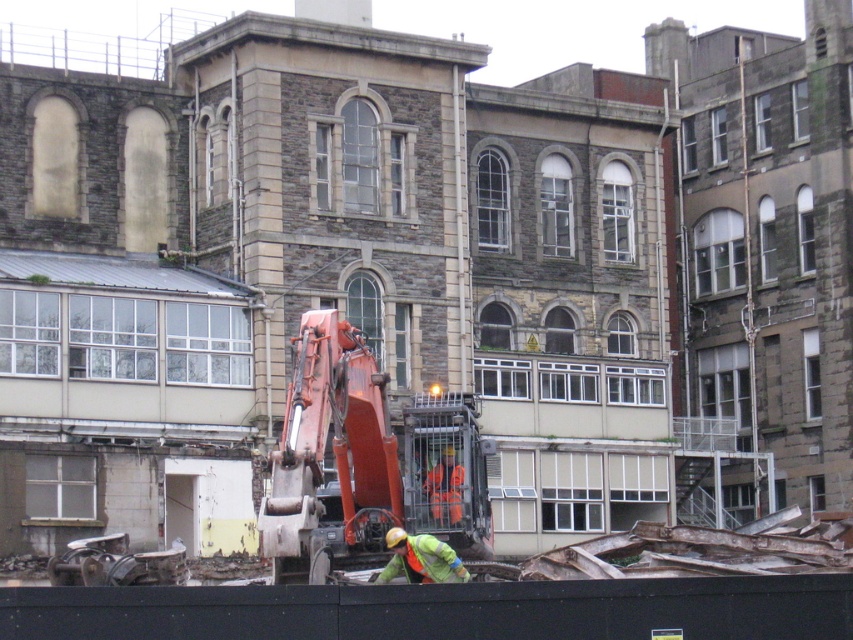
Can you confirm if orange metallic excavator at center is taller than green reflective jacket at center?

Indeed, orange metallic excavator at center has a greater height compared to green reflective jacket at center.

Is orange metallic excavator at center above green reflective jacket at center?

Yes.

Find the location of a particular element. The image size is (853, 640). orange metallic excavator at center is located at coordinates (367, 465).

Which is below, green reflective jacket at center or orange reflective safety vest at center?

Positioned lower is green reflective jacket at center.

Is green reflective jacket at center wider than orange reflective safety vest at center?

Correct, the width of green reflective jacket at center exceeds that of orange reflective safety vest at center.

Locate an element on the screen. green reflective jacket at center is located at coordinates (421, 560).

Is the position of orange metallic excavator at center more distant than that of orange reflective safety vest at center?

That is False.

Is point (343, 516) positioned after point (436, 518)?

Yes, point (343, 516) is behind point (436, 518).

Find the location of a particular element. orange metallic excavator at center is located at coordinates (367, 465).